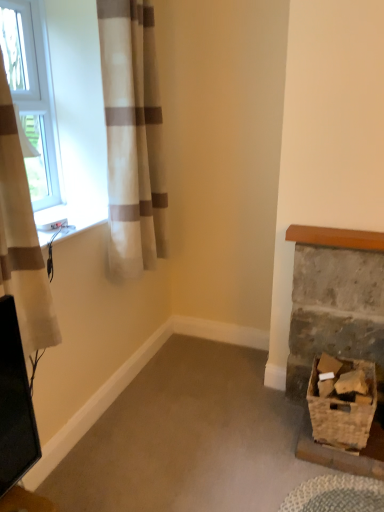
Find the location of a particular element. Image resolution: width=384 pixels, height=512 pixels. vacant space that is to the left of rustic wooden basket at lower right is located at coordinates (254, 408).